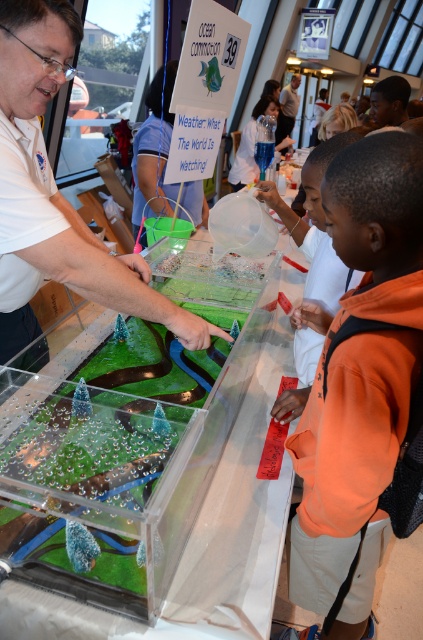
What is located at the point with coordinates [312,272] in the image?

The orange fleece jacket at lower right is located at point [312,272].

You are a student standing in front of the display box and notice the orange fleece jacket at right and the matte white shirt at upper center. Which object appears shorter in the scene?

The orange fleece jacket at right is not as tall as the matte white shirt at upper center, so the orange fleece jacket at right appears shorter.

You are observing the educational activity and need to hand a tool to the person closest to you. Which person should you approach, the orange fleece jacket at right or the matte white shirt at upper center?

The orange fleece jacket at right is closer to the viewer than the matte white shirt at upper center, so you should approach the orange fleece jacket at right.